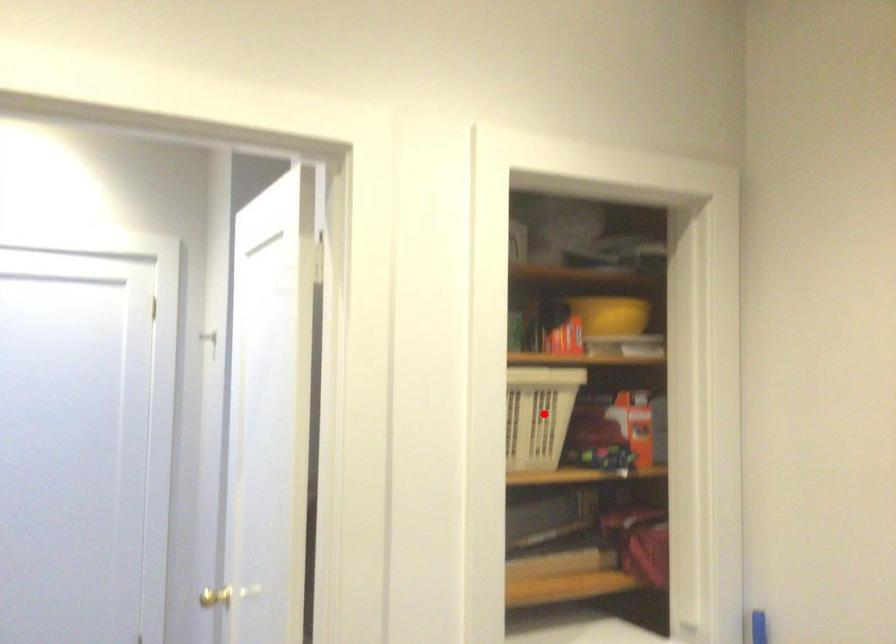
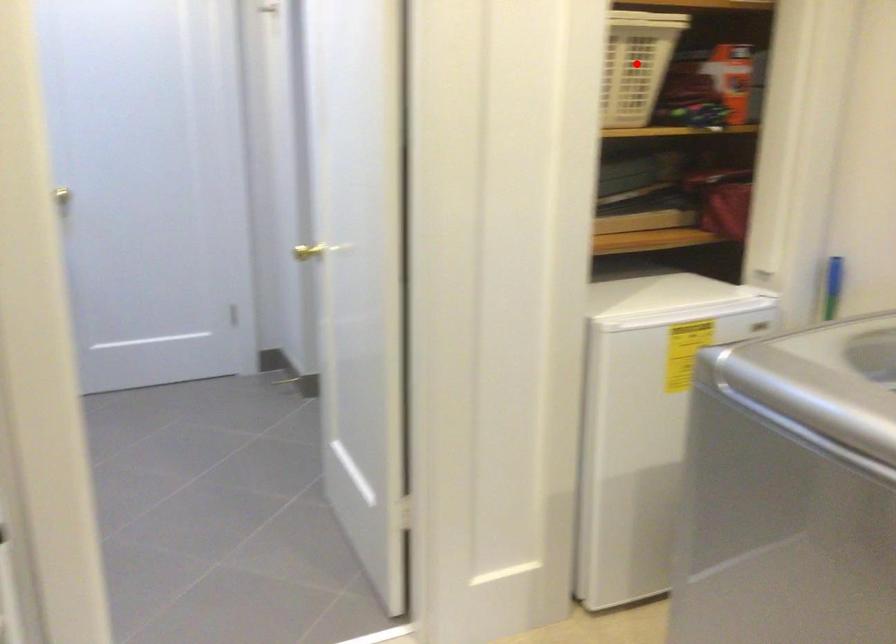
I am providing you with two images of the same scene from different viewpoints. A red point is marked on the first image and another point is marked on the second image. Is the marked point in image1 the same physical position as the marked point in image2?

Yes